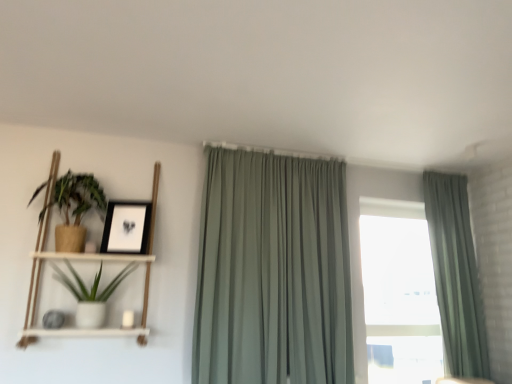
Locate an element on the screen. This screenshot has height=384, width=512. free space above white matte pot at left, the 1th houseplant positioned from the bottom (from a real-world perspective) is located at coordinates (101, 262).